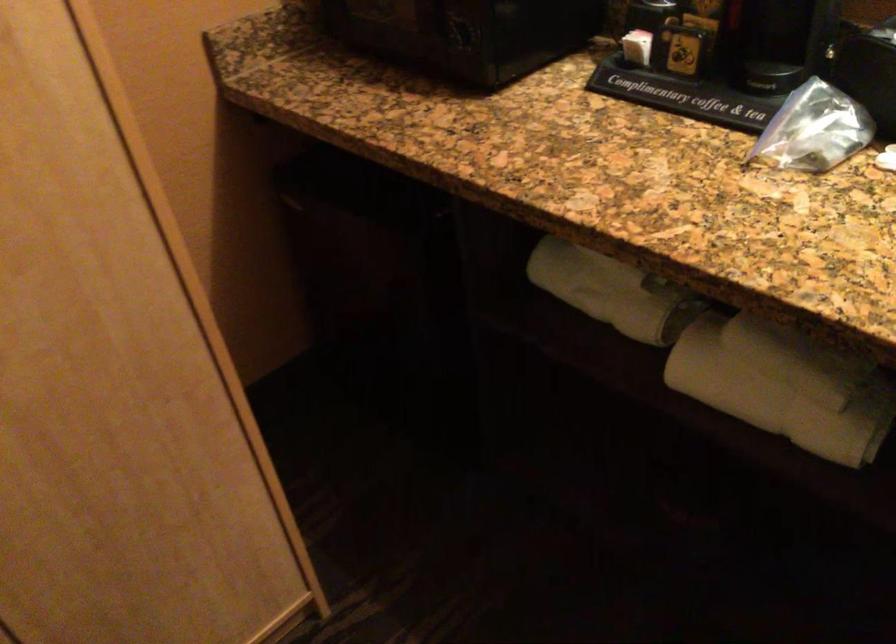
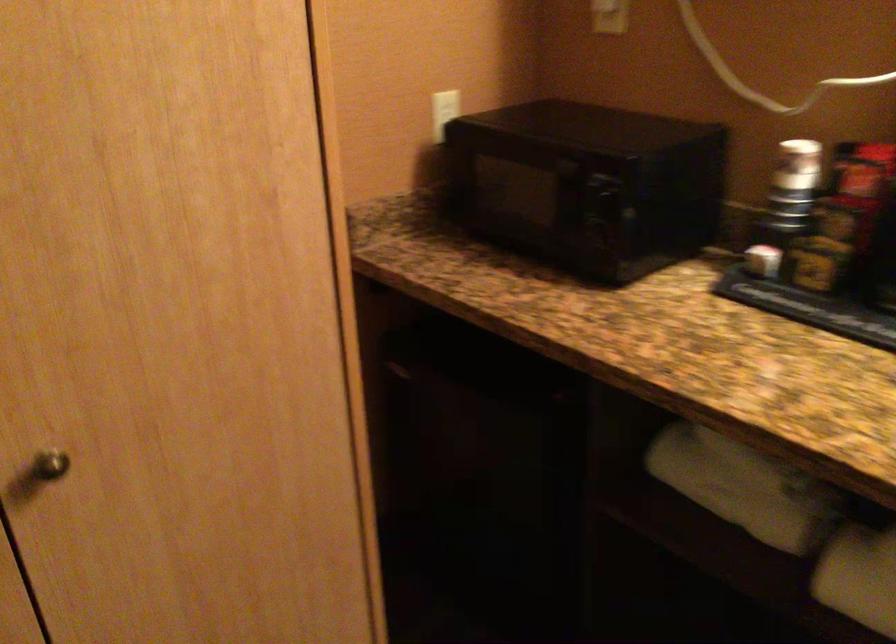
Locate, in the second image, the point that corresponds to (x=633, y=308) in the first image.

(764, 509)